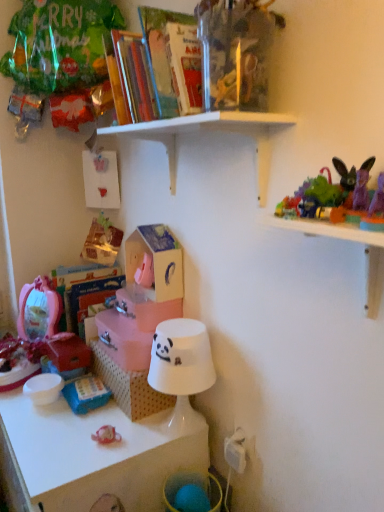
Question: In terms of size, does hardcover book at upper center appear bigger or smaller than white glossy lampshade at lower center, acting as the 3th shelf starting from the top?

Choices:
 (A) big
 (B) small

Answer: (B)

Question: Would you say hardcover book at upper center is inside or outside white glossy lampshade at lower center, acting as the 3th shelf starting from the top?

Choices:
 (A) outside
 (B) inside

Answer: (A)

Question: Estimate the real-world distances between objects in this image. Which object is closer to the white cardboard box at center?

Choices:
 (A) plush purple rabbit at upper right, the 1th toy positioned from the right
 (B) transparent plastic toys at upper right, arranged as the second shelf when viewed from the top
 (C) pink matte storage box at center, placed as the 2th storage box when sorted from top to bottom
 (D) blue plastic toy at lower left, which is the second toy in front-to-back order
 (E) hardcover book at upper center

Answer: (D)

Question: Estimate the real-world distances between objects in this image. Which object is closer to the transparent plastic toys at upper right, which is the 2th shelf in bottom-to-top order?

Choices:
 (A) wooden house at center, which is the second storage box from bottom to top
 (B) white matte lampshade at center
 (C) plush purple rabbit at upper right, arranged as the third toy when viewed from the left
 (D) pink matte storage box at center, which ranks as the 1th storage box in bottom-to-top order
 (E) white glossy lampshade at lower center, which ranks as the first shelf in bottom-to-top order

Answer: (C)